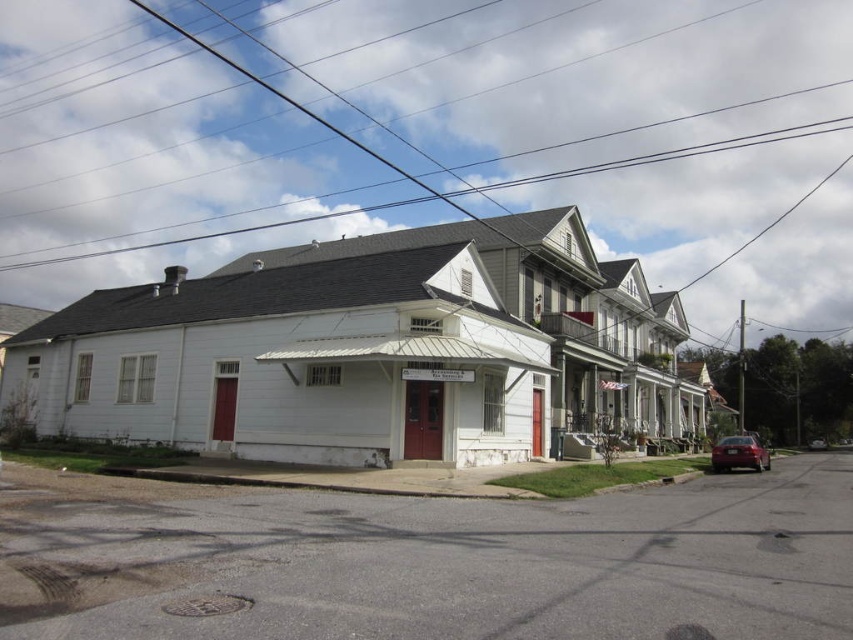
Question: Which object is farther from the camera taking this photo?

Choices:
 (A) shiny red sedan at lower right
 (B) metallic silver car at right

Answer: (B)

Question: Can you confirm if shiny red sedan at lower right is positioned to the left of metallic silver car at right?

Choices:
 (A) yes
 (B) no

Answer: (A)

Question: Does shiny red sedan at lower right have a larger size compared to metallic silver car at right?

Choices:
 (A) yes
 (B) no

Answer: (A)

Question: Which point is farther to the camera?

Choices:
 (A) (810, 449)
 (B) (759, 458)

Answer: (A)

Question: Is shiny red sedan at lower right to the left of metallic silver car at right from the viewer's perspective?

Choices:
 (A) yes
 (B) no

Answer: (A)